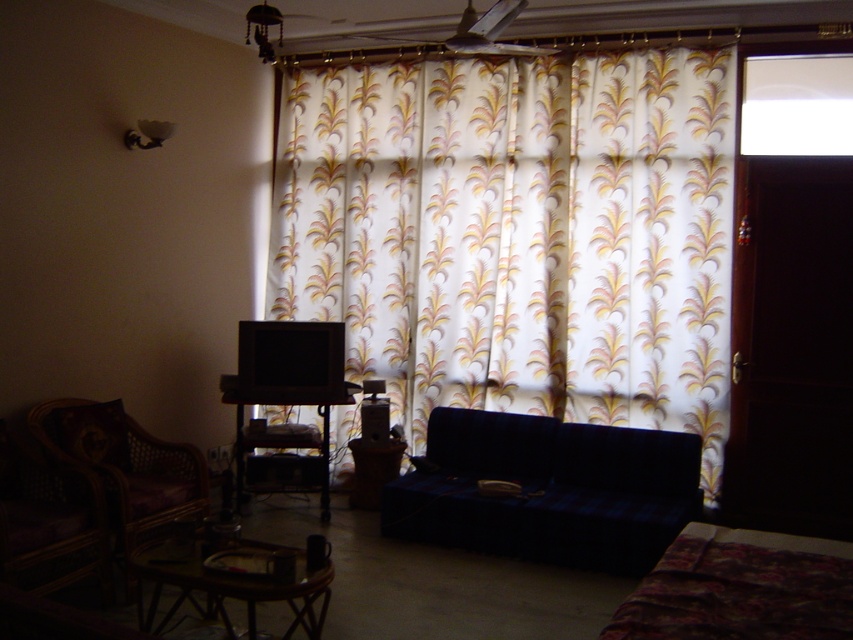
You are planning to place a new rug in the living room. The rug you have is exactly the same size as the metallic lampshade at upper center. Can the rug fit under the velvet blue couch at center without overlapping its edges?

The velvet blue couch at center has a larger size compared to metallic lampshade at upper center. Since the rug is the same size as the metallic lampshade, it will fit under the velvet blue couch at center without overlapping the edges because the couch is bigger.

Based on the photo, you are standing at the entrance of the living room and want to sit on the velvet blue couch at center. Which direction should you walk to reach it?

You should walk towards the center of the living room to reach the velvet blue couch at center.

You are planning to place a decorative vase on the wooden table at lower center. Considering the size of the matte white lampshade at upper left, will the vase fit on the table?

The wooden table at lower center has a larger size compared to the matte white lampshade at upper left. Since the table is bigger, the vase should fit comfortably on it.